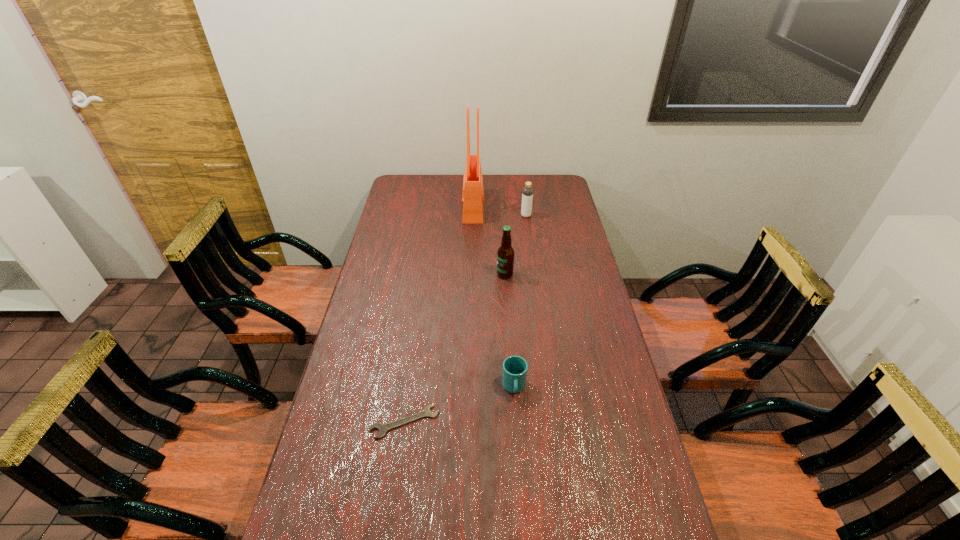
Where is `free space at the left edge of the desktop`? free space at the left edge of the desktop is located at coordinates (393, 217).

The width and height of the screenshot is (960, 540). Find the location of `vacant space at the right edge`. vacant space at the right edge is located at coordinates (647, 534).

The height and width of the screenshot is (540, 960). What are the coordinates of `free space between the tote bag and the rightmost object` in the screenshot? It's located at (499, 211).

Where is `free space between the beer bottle and the tallest object`? The width and height of the screenshot is (960, 540). free space between the beer bottle and the tallest object is located at coordinates (489, 241).

Locate an element on the screen. free space between the rightmost object and the fourth shortest object is located at coordinates (516, 245).

At what (x,y) coordinates should I click in order to perform the action: click on vacant space that's between the third nearest object and the tote bag. Please return your answer as a coordinate pair (x, y). Image resolution: width=960 pixels, height=540 pixels. Looking at the image, I should click on pos(489,241).

What are the coordinates of `empty space between the shortest object and the tote bag` in the screenshot? It's located at (439, 314).

This screenshot has width=960, height=540. Identify the location of vacant area that lies between the beer bottle and the second nearest object. (510, 331).

Find the location of a particular element. This screenshot has height=540, width=960. vacant region between the cup and the beer bottle is located at coordinates (510, 331).

Locate an element on the screen. The height and width of the screenshot is (540, 960). free spot between the second shortest object and the fourth shortest object is located at coordinates (510, 331).